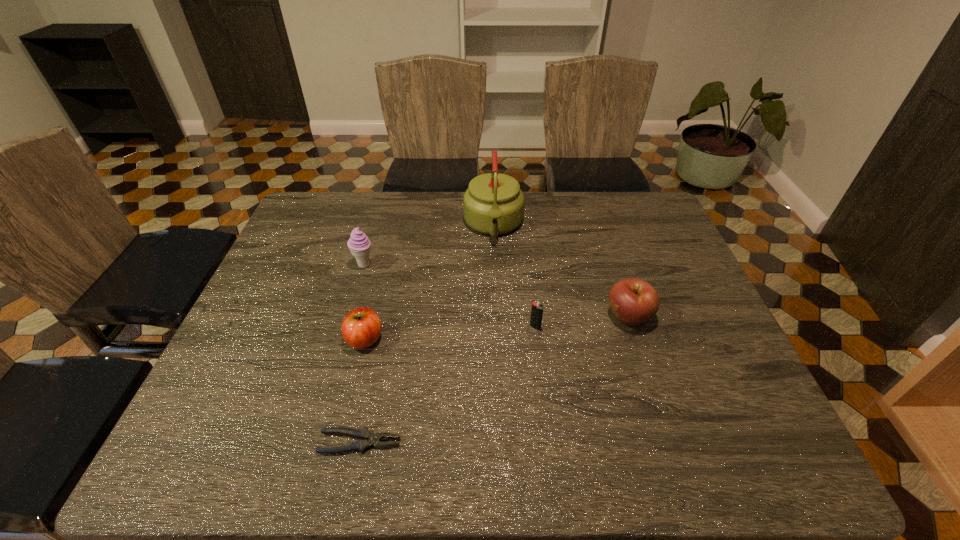
Find the location of `free space between the igniter and the second tallest object`. free space between the igniter and the second tallest object is located at coordinates (449, 296).

Image resolution: width=960 pixels, height=540 pixels. I want to click on empty location between the farthest object and the second farthest object, so click(429, 245).

Locate an element on the screen. free space between the right apple and the pliers is located at coordinates (494, 380).

The height and width of the screenshot is (540, 960). Find the location of `free spot between the left apple and the shortest object`. free spot between the left apple and the shortest object is located at coordinates click(363, 391).

At what (x,y) coordinates should I click in order to perform the action: click on free spot between the right apple and the tallest object. Please return your answer as a coordinate pair (x, y). Looking at the image, I should click on (561, 271).

Select which object appears as the fifth closest to the igniter. Please provide its 2D coordinates. Your answer should be formatted as a tuple, i.e. [(x, y)], where the tuple contains the x and y coordinates of a point satisfying the conditions above.

[(359, 244)]

The width and height of the screenshot is (960, 540). Identify the location of object that is the nearest to the fifth nearest object. (361, 327).

Locate an element on the screen. vacant space that satisfies the following two spatial constraints: 1. at the spout of the tallest object; 2. at the gripping part of the nearest object is located at coordinates (502, 442).